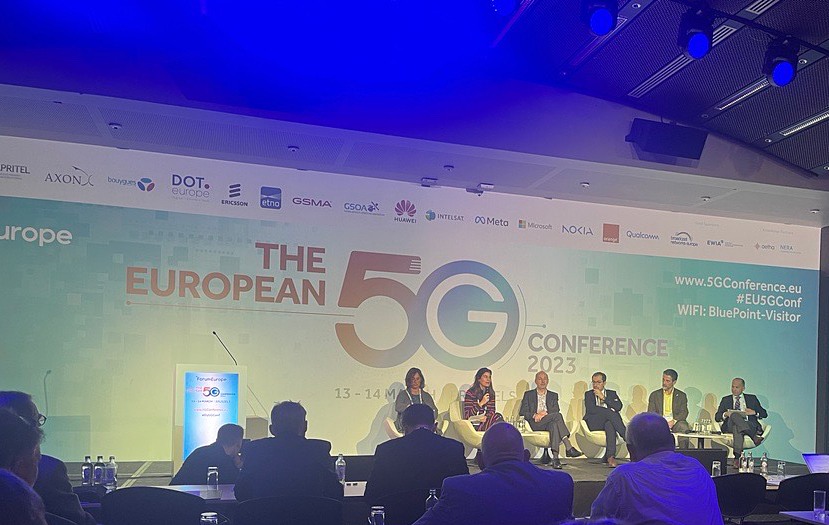
At what (x,y) coordinates should I click in order to perform the action: click on blue spot lights. Please return your answer as a coordinate pair (x, y). The image size is (829, 525). Looking at the image, I should click on (783, 73), (694, 45), (597, 10), (505, 5).